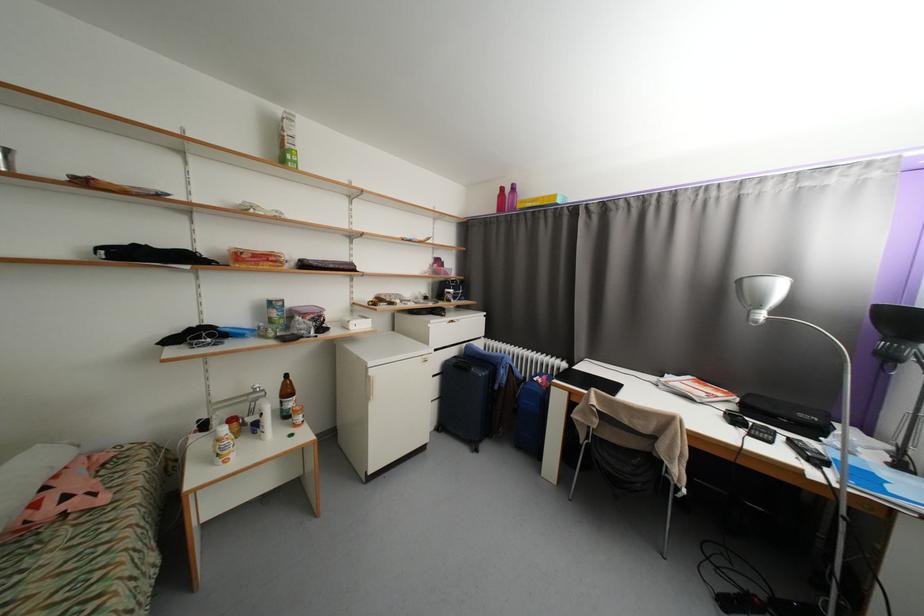
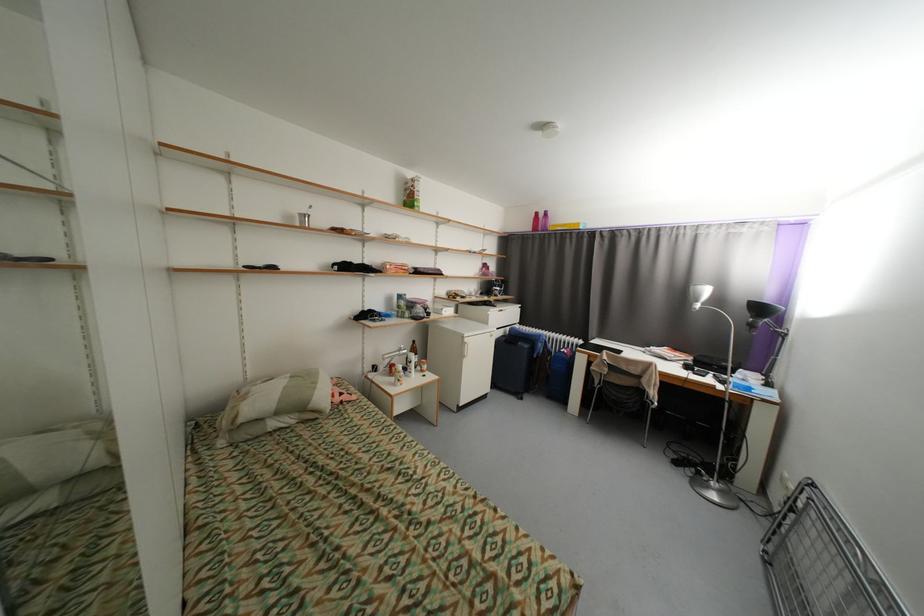
The point at (x=883, y=308) is marked in the first image. Where is the corresponding point in the second image?

(756, 302)